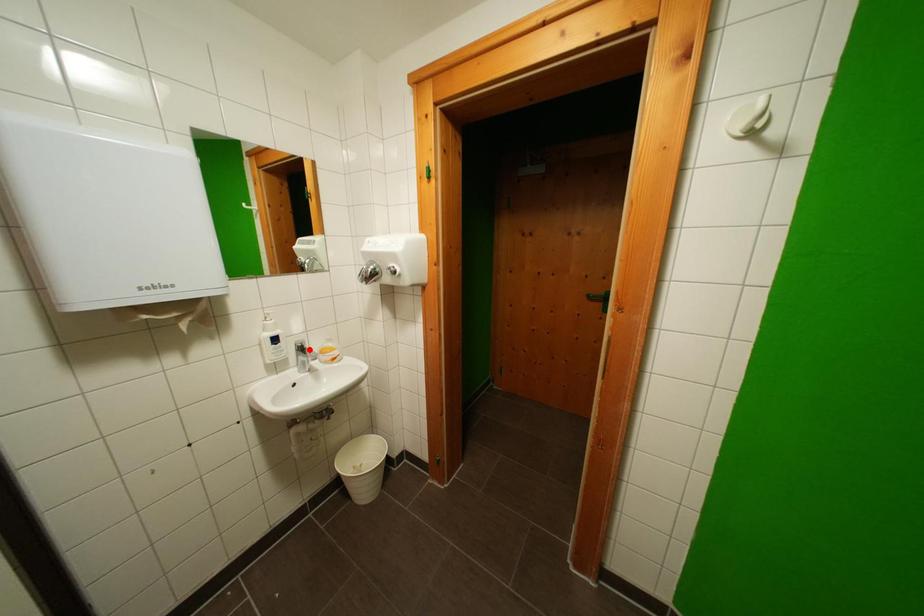
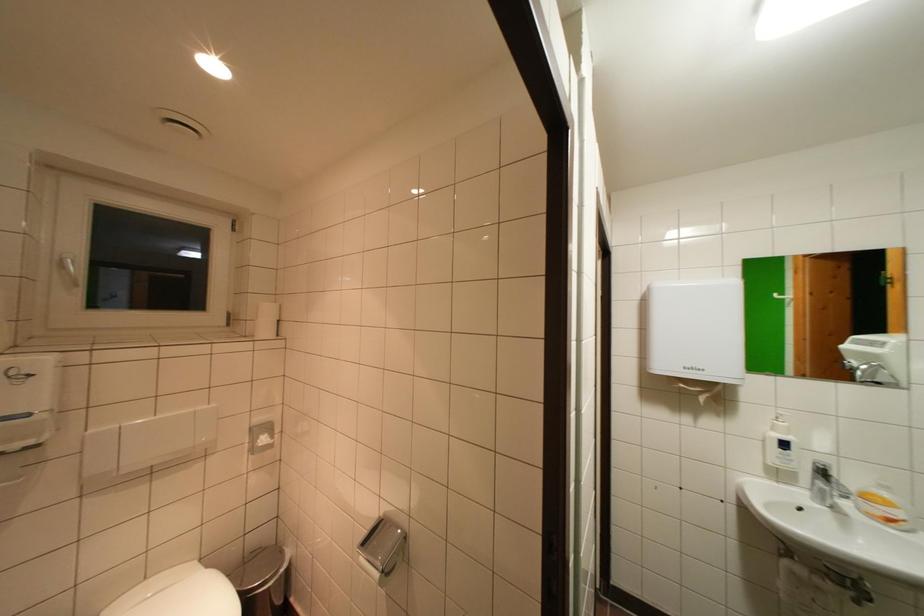
Find the pixel in the second image that matches the highlighted location in the first image.

(833, 474)